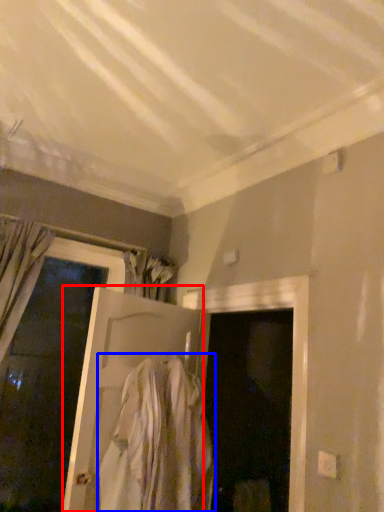
Question: Which object is closer to the camera taking this photo, door (highlighted by a red box) or clothing (highlighted by a blue box)?

Choices:
 (A) door
 (B) clothing

Answer: (B)